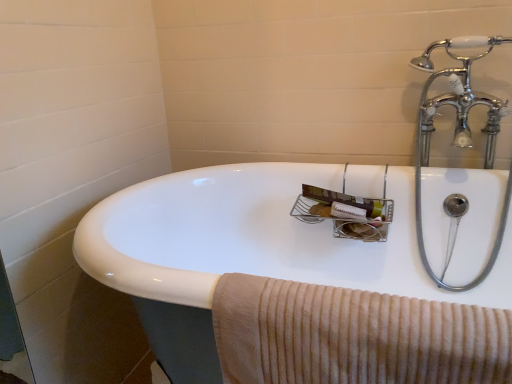
Question: Should I look upward or downward to see beige corduroy towel at lower right?

Choices:
 (A) down
 (B) up

Answer: (A)

Question: Does white glossy sink at center have a greater width compared to beige corduroy towel at lower right?

Choices:
 (A) yes
 (B) no

Answer: (A)

Question: Is white glossy sink at center completely or partially outside of beige corduroy towel at lower right?

Choices:
 (A) yes
 (B) no

Answer: (A)

Question: From a real-world perspective, is white glossy sink at center positioned under beige corduroy towel at lower right based on gravity?

Choices:
 (A) yes
 (B) no

Answer: (A)

Question: From the image's perspective, is white glossy sink at center below beige corduroy towel at lower right?

Choices:
 (A) no
 (B) yes

Answer: (B)

Question: Is white glossy sink at center thinner than beige corduroy towel at lower right?

Choices:
 (A) yes
 (B) no

Answer: (B)

Question: Is beige corduroy towel at lower right inside white glossy sink at center?

Choices:
 (A) no
 (B) yes

Answer: (B)

Question: Would you say beige corduroy towel at lower right is a long distance from white glossy sink at center?

Choices:
 (A) no
 (B) yes

Answer: (A)

Question: Is beige corduroy towel at lower right directly adjacent to white glossy sink at center?

Choices:
 (A) yes
 (B) no

Answer: (B)

Question: Is beige corduroy towel at lower right looking in the opposite direction of white glossy sink at center?

Choices:
 (A) no
 (B) yes

Answer: (B)

Question: From the image's perspective, is beige corduroy towel at lower right located above white glossy sink at center?

Choices:
 (A) yes
 (B) no

Answer: (A)

Question: Considering the relative sizes of beige corduroy towel at lower right and white glossy sink at center in the image provided, is beige corduroy towel at lower right bigger than white glossy sink at center?

Choices:
 (A) yes
 (B) no

Answer: (B)

Question: Does beige corduroy towel at lower right appear on the right side of white glossy sink at center?

Choices:
 (A) yes
 (B) no

Answer: (B)

Question: Is point (337, 168) positioned closer to the camera than point (245, 374)?

Choices:
 (A) farther
 (B) closer

Answer: (A)